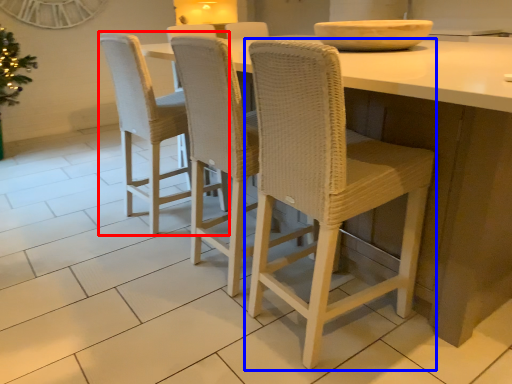
Question: Which of the following is the closest to the observer, chair (highlighted by a red box) or chair (highlighted by a blue box)?

Choices:
 (A) chair
 (B) chair

Answer: (B)